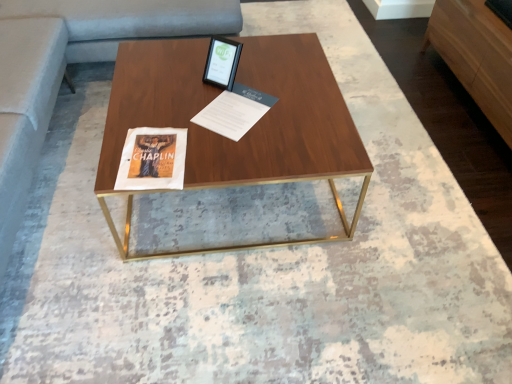
This screenshot has height=384, width=512. What are the coordinates of `free spot below white paper at center (from a real-world perspective)` in the screenshot? It's located at (234, 107).